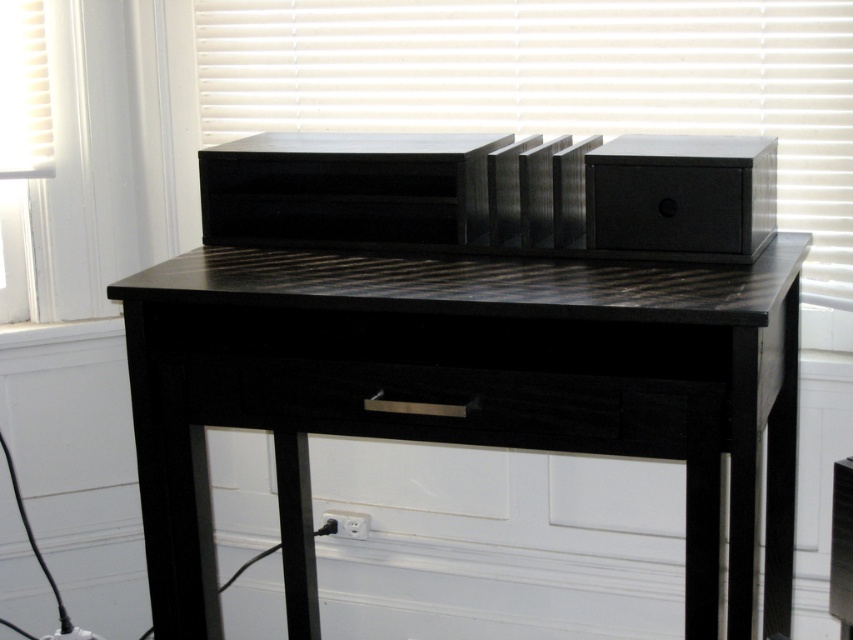
What do you see at coordinates (463, 392) in the screenshot?
I see `black wood table at center` at bounding box center [463, 392].

Is point (560, 358) positioned after point (601, 410)?

Yes, point (560, 358) is farther from viewer.

Where is `black wood table at center`? The width and height of the screenshot is (853, 640). black wood table at center is located at coordinates (463, 392).

Is matte black speaker at upper center closer to the viewer compared to black matte drawer at center?

No, matte black speaker at upper center is behind black matte drawer at center.

Which of these two, matte black speaker at upper center or black matte drawer at center, stands shorter?

With less height is black matte drawer at center.

Locate an element on the screen. matte black speaker at upper center is located at coordinates (556, 81).

Between black wood table at center and matte black speaker at upper center, which one is positioned lower?

Positioned lower is black wood table at center.

Can you confirm if black wood table at center is shorter than matte black speaker at upper center?

Incorrect, black wood table at center's height does not fall short of matte black speaker at upper center's.

Which is in front, point (759, 413) or point (289, 22)?

Point (759, 413) is more forward.

Identify the location of black wood table at center. (463, 392).